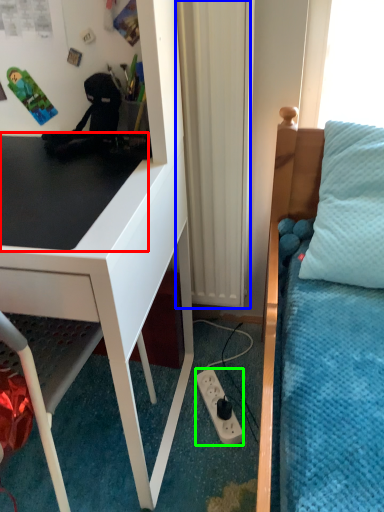
Question: Estimate the real-world distances between objects in this image. Which object is closer to table top (highlighted by a red box), curtain (highlighted by a blue box) or power outlet (highlighted by a green box)?

Choices:
 (A) curtain
 (B) power outlet

Answer: (A)